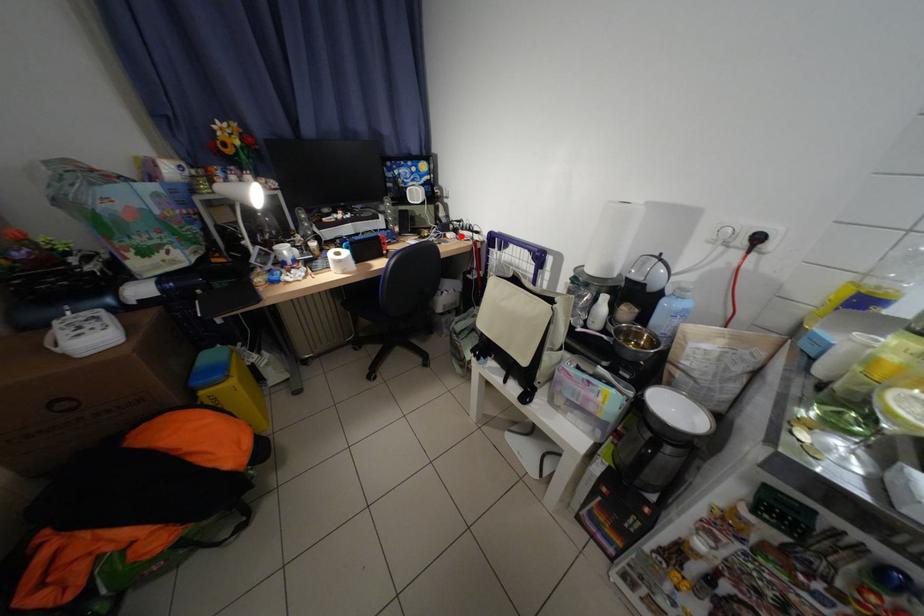
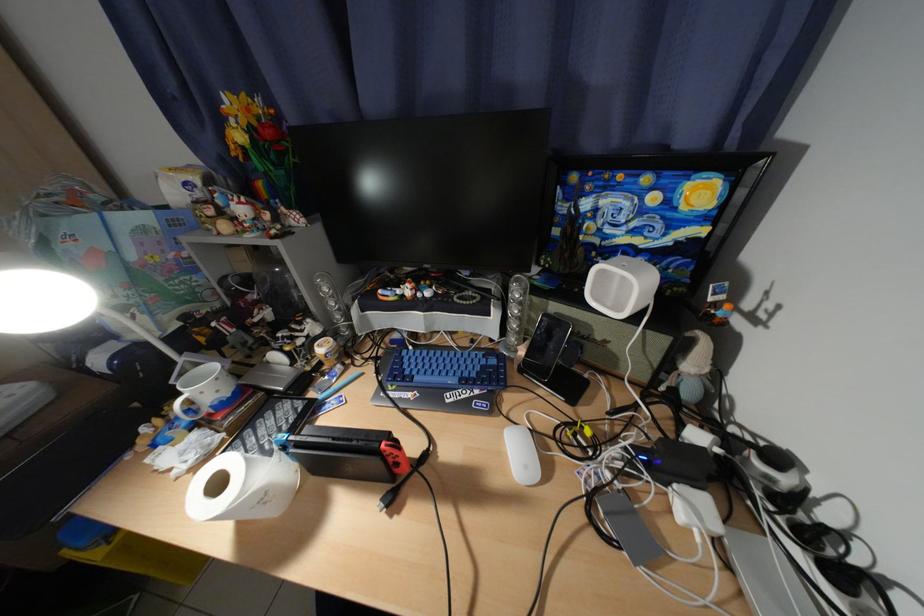
Question: I am providing you with two images of the same scene from different viewpoints. Given a red point in image1, look at the same physical point in image2. Is it:

Choices:
 (A) Closer to the viewpoint
 (B) Farther from the viewpoint

Answer: (B)